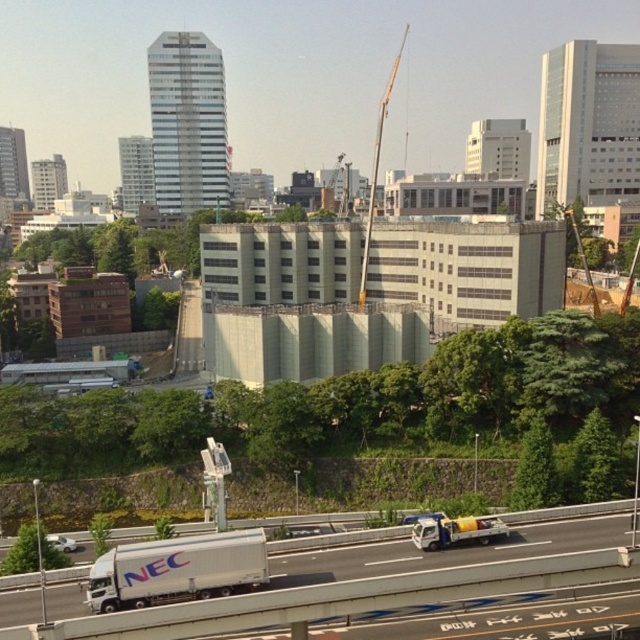
Question: Which object appears closest to the camera in this image?

Choices:
 (A) white matte truck at lower left
 (B) white glossy truck at lower left
 (C) metallic gray crane at center

Answer: (B)

Question: Does white glossy truck at lower left have a larger size compared to white matte truck at lower center?

Choices:
 (A) yes
 (B) no

Answer: (A)

Question: Based on their relative distances, which object is farther from the white matte truck at lower center?

Choices:
 (A) white glossy truck at lower left
 (B) metallic gray crane at center
 (C) white matte truck at lower left

Answer: (B)

Question: Which object is farther from the camera taking this photo?

Choices:
 (A) white matte truck at lower center
 (B) white matte trailer truck at lower left

Answer: (A)

Question: Can you confirm if white glossy truck at lower left is thinner than white matte truck at lower center?

Choices:
 (A) no
 (B) yes

Answer: (A)

Question: Can you confirm if metallic gray crane at center is smaller than white matte truck at lower left?

Choices:
 (A) yes
 (B) no

Answer: (B)